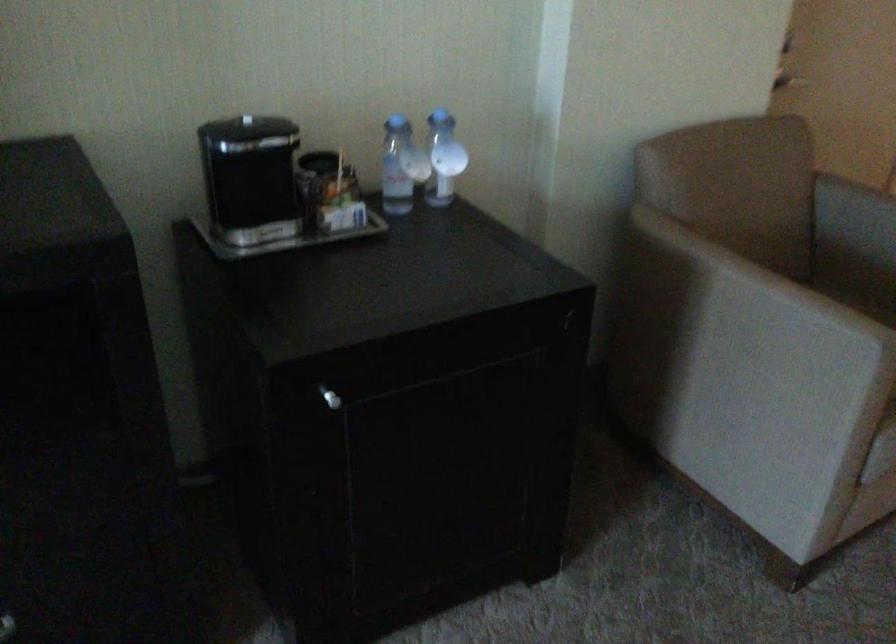
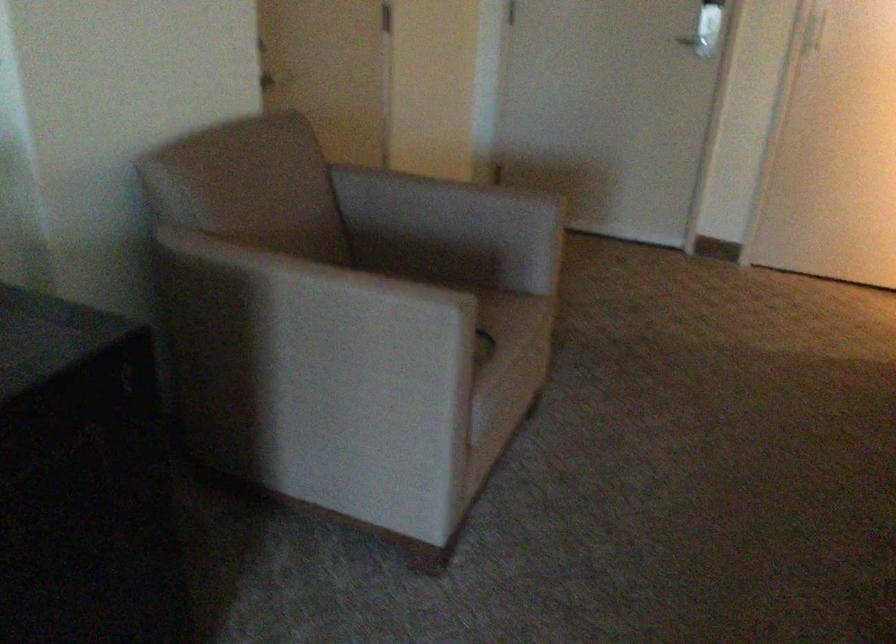
In the second image, find the point that corresponds to [859,303] in the first image.

(401, 285)